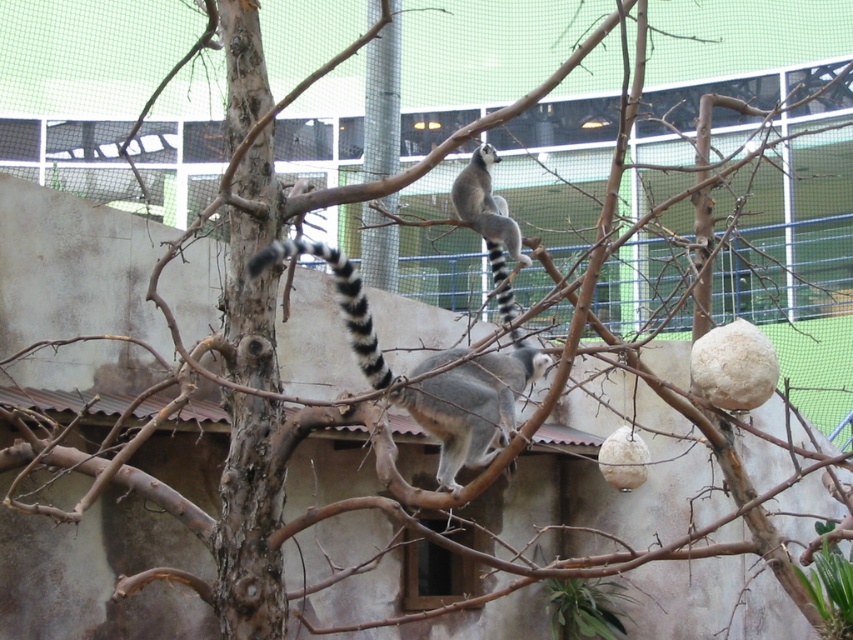
Is ring-tailed fur at center to the right of black and white striped tail at center from the viewer's perspective?

Yes, ring-tailed fur at center is to the right of black and white striped tail at center.

Does point (440, 419) lie in front of point (369, 355)?

No, it is behind (369, 355).

This screenshot has height=640, width=853. Identify the location of ring-tailed fur at center. (473, 404).

Is point (438, 468) in front of point (515, 252)?

Yes, it is.

Does ring-tailed fur at center appear under ring-tailed lemur at center?

Yes, ring-tailed fur at center is below ring-tailed lemur at center.

Between point (267, 250) and point (469, 200), which one is positioned in front?

Point (267, 250) is in front.

Identify the location of ring-tailed fur at center. (473, 404).

Which is in front, point (496, 241) or point (286, 246)?

Point (286, 246) is more forward.

Which is in front, point (506, 240) or point (372, 364)?

Positioned in front is point (372, 364).

At what (x,y) coordinates should I click in order to perform the action: click on ring-tailed lemur at center. Please return your answer as a coordinate pair (x, y). This screenshot has width=853, height=640. Looking at the image, I should click on (486, 211).